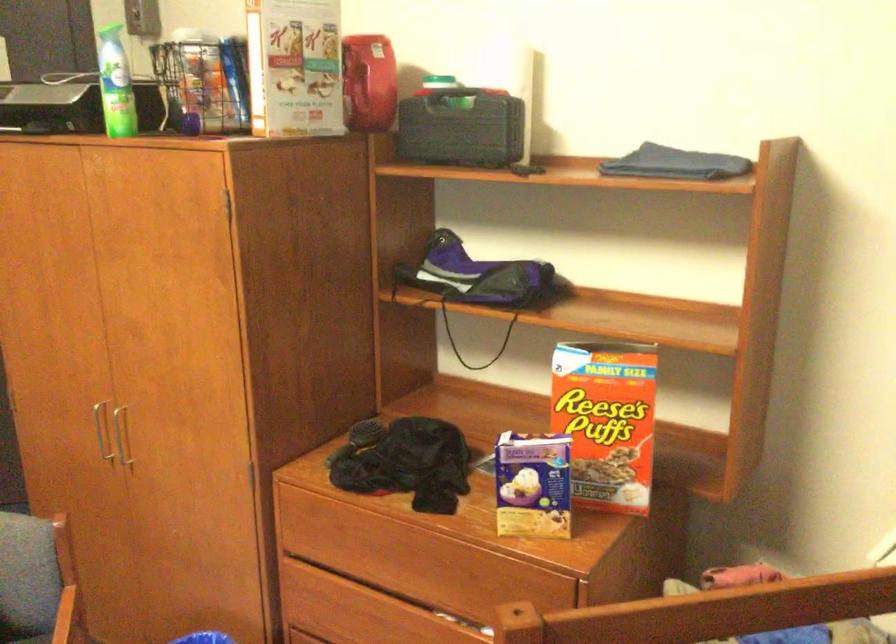
This screenshot has width=896, height=644. In order to click on small food box in this screenshot , I will do `click(606, 420)`.